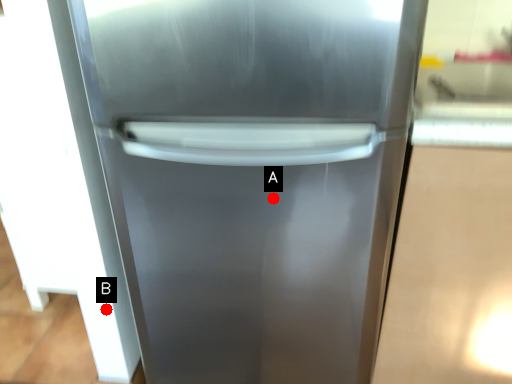
Question: Two points are circled on the image, labeled by A and B beside each circle. Which point is closer to the camera?

Choices:
 (A) A is closer
 (B) B is closer

Answer: (A)